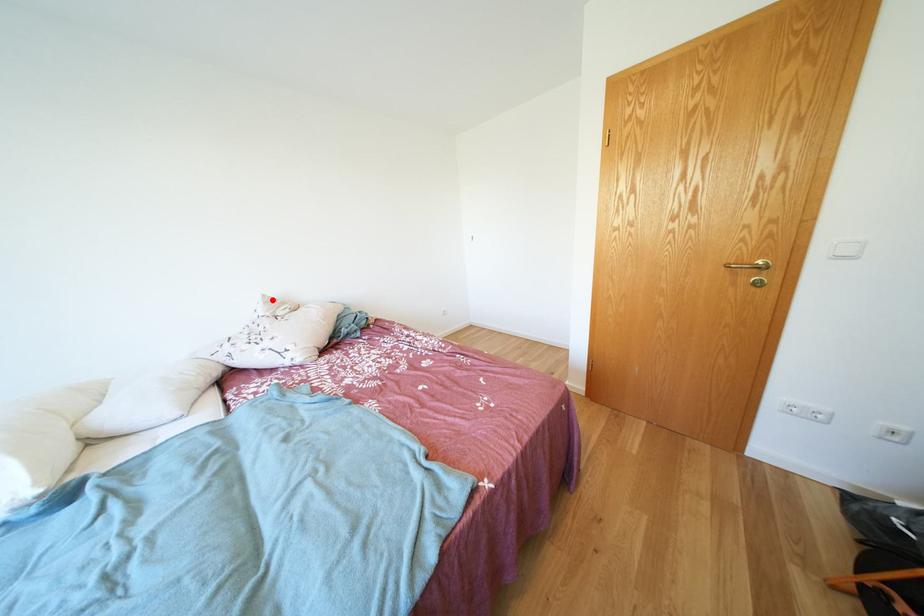
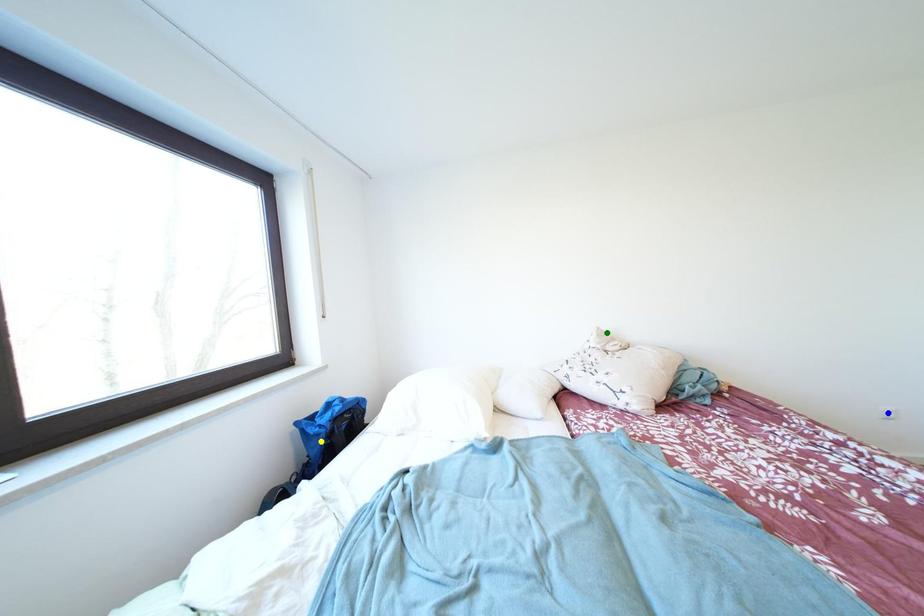
Question: I am providing you with two images of the same scene from different viewpoints. A red point is marked on the first image. You are given multiple points on the second image. In image 2, which mark is for the same physical point as the one in image 1?

Choices:
 (A) green point
 (B) blue point
 (C) yellow point

Answer: (A)